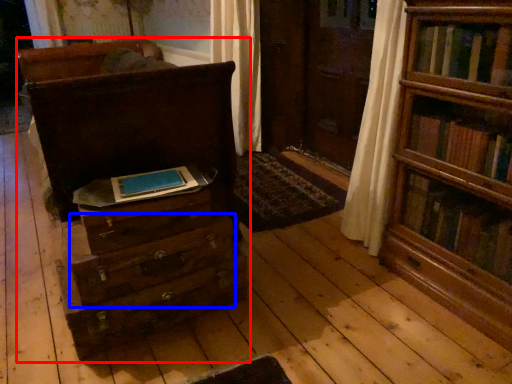
Question: Among these objects, which one is farthest to the camera, chest of drawers (highlighted by a red box) or drawer (highlighted by a blue box)?

Choices:
 (A) chest of drawers
 (B) drawer

Answer: (B)